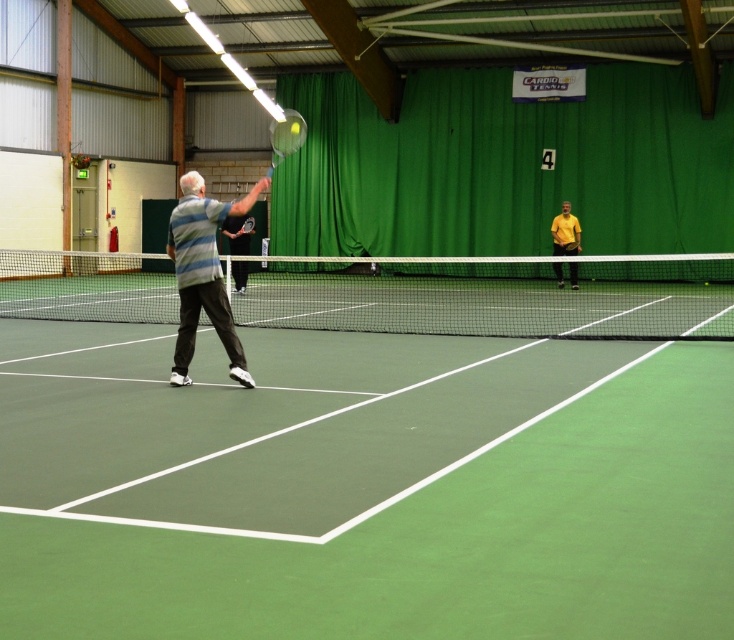
Who is shorter, striped cotton shirt at center or yellow matte shirt at center?

Standing shorter between the two is striped cotton shirt at center.

Can you confirm if striped cotton shirt at center is thinner than yellow matte shirt at center?

Indeed, striped cotton shirt at center has a lesser width compared to yellow matte shirt at center.

Is point (188, 189) more distant than point (573, 284)?

No, it is not.

I want to click on striped cotton shirt at center, so click(203, 273).

Who is lower down, white mesh net at center or matte gray shirt at center?

white mesh net at center is lower down.

The height and width of the screenshot is (640, 734). What are the coordinates of `white mesh net at center` in the screenshot? It's located at pos(495,296).

Find the location of `white mesh net at center`. white mesh net at center is located at coordinates point(495,296).

Consider the image. Between metallic silver tennis racket at upper center and matte gray shirt at center, which one has less height?

With less height is matte gray shirt at center.

In the scene shown: Can you confirm if metallic silver tennis racket at upper center is wider than matte gray shirt at center?

Yes.

The width and height of the screenshot is (734, 640). Describe the element at coordinates (286, 136) in the screenshot. I see `metallic silver tennis racket at upper center` at that location.

At what (x,y) coordinates should I click in order to perform the action: click on metallic silver tennis racket at upper center. Please return your answer as a coordinate pair (x, y). Looking at the image, I should click on (286, 136).